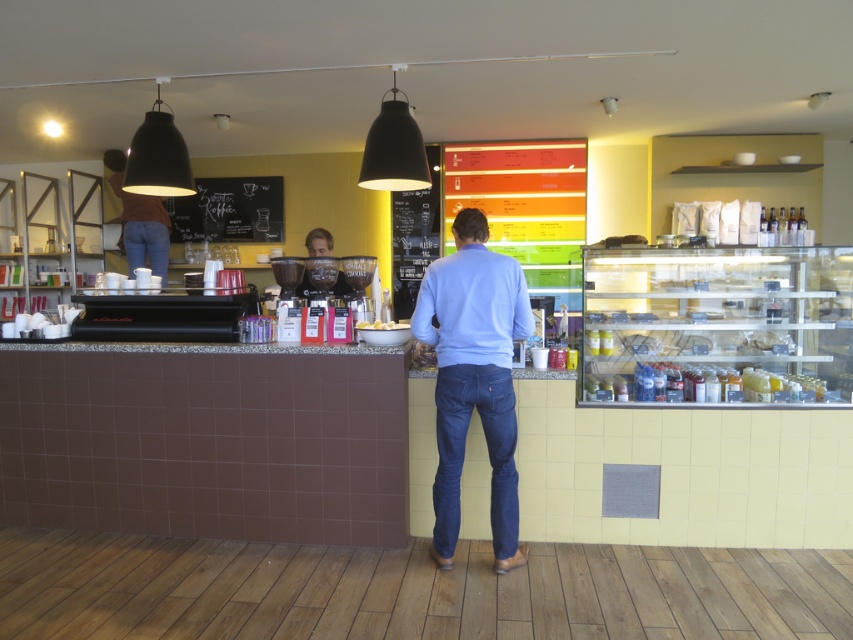
You are a customer standing at the entrance of the cozy cafe and want to reach both the counter and the display case. The counter is located at point [439,289] and the display case is at point [392,328]. Which location is closer to you?

Point [439,289] is closer to the viewer than point [392,328], so the counter is closer to you.

You are standing in the cozy cafe and see the blue denim jeans at center. If you want to reach the display case on the right, which is 15 feet away from you, can you walk straight ahead from your current position to the display case without moving around any obstacles?

The blue denim jeans at center is 9.79 feet from the viewer, so if the display case is 15 feet away, you can walk straight ahead as there is enough space between you and the blue denim jeans at center to reach the display case.